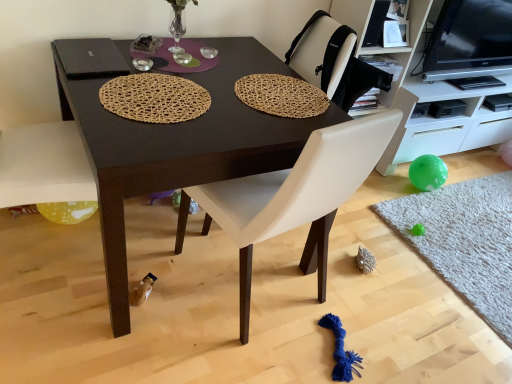
Question: From their relative heights in the image, would you say white leather chair at center is taller or shorter than woven natural mat at upper center, which is the second mat in right-to-left order?

Choices:
 (A) tall
 (B) short

Answer: (A)

Question: From the image's perspective, is white leather chair at center positioned above or below woven natural mat at upper center, which is the second mat in right-to-left order?

Choices:
 (A) above
 (B) below

Answer: (B)

Question: Estimate the real-world distances between objects in this image. Which object is farther from the white glossy cabinet at right?

Choices:
 (A) woven natural mat at center, which is counted as the first mat, starting from the left
 (B) white leather chair at center
 (C) gray shaggy rug at lower right, acting as the 3th mat starting from the top
 (D) woven natural mat at upper center, acting as the third mat starting from the bottom
 (E) black glossy tv at upper right

Answer: (A)

Question: Considering the real-world distances, which object is closest to the woven natural mat at upper center, the 1th mat when ordered from top to bottom?

Choices:
 (A) white glossy cabinet at right
 (B) white leather chair at center
 (C) black glossy tv at upper right
 (D) translucent yellow balloon at lower left
 (E) dark brown wood table at center

Answer: (E)